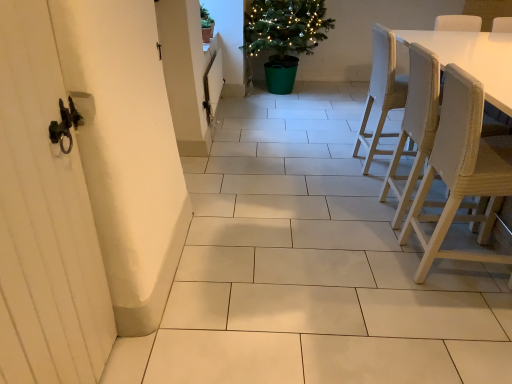
Question: Does white wooden screen door at left come in front of light brown woven chair at right, which is the second chair from back to front?

Choices:
 (A) no
 (B) yes

Answer: (B)

Question: From the image's perspective, is white wooden screen door at left on light brown woven chair at right, which is counted as the 2th chair, starting from the front?

Choices:
 (A) yes
 (B) no

Answer: (B)

Question: Is light brown woven chair at right, which is counted as the 2th chair, starting from the front, surrounded by white wooden screen door at left?

Choices:
 (A) no
 (B) yes

Answer: (A)

Question: Would you say white wooden screen door at left is outside light brown woven chair at right, which is counted as the 2th chair, starting from the front?

Choices:
 (A) yes
 (B) no

Answer: (A)

Question: Is white wooden screen door at left aimed at light brown woven chair at right, which is counted as the 2th chair, starting from the front?

Choices:
 (A) yes
 (B) no

Answer: (B)

Question: Is woven wood chair at right, the third chair in the back-to-front sequence, in front of or behind light beige fabric chair at right, which is counted as the first chair, starting from the back, in the image?

Choices:
 (A) behind
 (B) front

Answer: (B)

Question: Does point (497, 180) appear closer or farther from the camera than point (379, 102)?

Choices:
 (A) farther
 (B) closer

Answer: (B)

Question: Would you say woven wood chair at right, marked as the 1th chair in a front-to-back arrangement, is inside or outside light beige fabric chair at right, the 3th chair viewed from the front?

Choices:
 (A) inside
 (B) outside

Answer: (B)

Question: Considering the positions of woven wood chair at right, marked as the 1th chair in a front-to-back arrangement, and light beige fabric chair at right, the 3th chair viewed from the front, in the image, is woven wood chair at right, marked as the 1th chair in a front-to-back arrangement, wider or thinner than light beige fabric chair at right, the 3th chair viewed from the front,?

Choices:
 (A) thin
 (B) wide

Answer: (A)

Question: Looking at their shapes, would you say light beige fabric chair at right, the 3th chair viewed from the front, is wider or thinner than white wooden screen door at left?

Choices:
 (A) thin
 (B) wide

Answer: (B)

Question: Based on their positions, is light beige fabric chair at right, which is counted as the first chair, starting from the back, located to the left or right of white wooden screen door at left?

Choices:
 (A) right
 (B) left

Answer: (A)

Question: Looking at the image, does light beige fabric chair at right, the 3th chair viewed from the front, seem bigger or smaller compared to white wooden screen door at left?

Choices:
 (A) small
 (B) big

Answer: (B)

Question: Is point (392, 62) positioned closer to the camera than point (47, 104)?

Choices:
 (A) farther
 (B) closer

Answer: (A)

Question: Is white wooden screen door at left taller or shorter than light beige fabric chair at right, the 3th chair viewed from the front?

Choices:
 (A) short
 (B) tall

Answer: (B)

Question: Considering the relative positions of white wooden screen door at left and light beige fabric chair at right, the 3th chair viewed from the front, in the image provided, is white wooden screen door at left to the left or to the right of light beige fabric chair at right, the 3th chair viewed from the front,?

Choices:
 (A) left
 (B) right

Answer: (A)